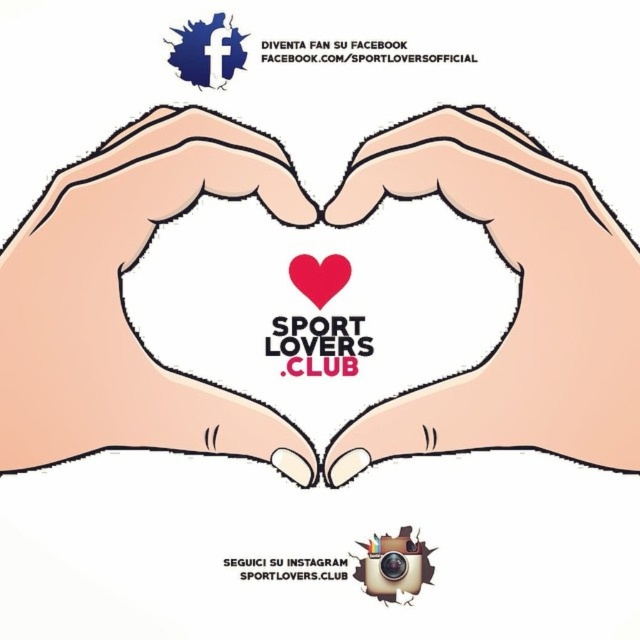
Which is more to the right, smooth beige hand at center or pink matte heart at center?

pink matte heart at center

From the picture: Can you confirm if smooth beige hand at center is positioned to the left of pink matte heart at center?

Correct, you'll find smooth beige hand at center to the left of pink matte heart at center.

Does point (81, 282) lie behind point (419, 426)?

No, (81, 282) is closer to viewer.

This screenshot has width=640, height=640. In order to click on smooth beige hand at center in this screenshot , I will do `click(122, 301)`.

In order to click on pink matte hands at center in this screenshot , I will do `click(304, 227)`.

Can you confirm if pink matte hands at center is positioned below matte red heart at center?

Yes, pink matte hands at center is below matte red heart at center.

Identify the location of pink matte hands at center. (304, 227).

Find the location of `pink matte hands at center`. pink matte hands at center is located at coordinates coord(304,227).

In the scene shown: Which is more to the left, pink matte heart at center or matte red heart at center?

matte red heart at center is more to the left.

Who is positioned more to the right, pink matte heart at center or matte red heart at center?

Positioned to the right is pink matte heart at center.

In order to click on pink matte heart at center in this screenshot , I will do click(516, 300).